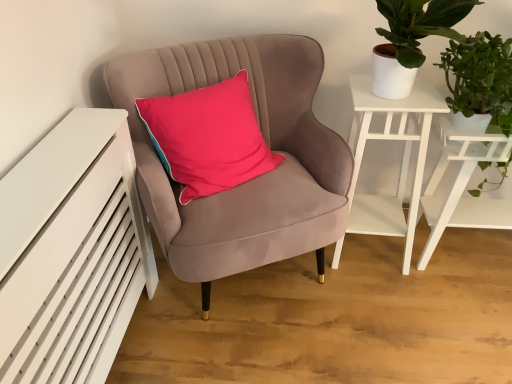
Locate an element on the screen. free spot below velvet pink chair at center (from a real-world perspective) is located at coordinates (245, 292).